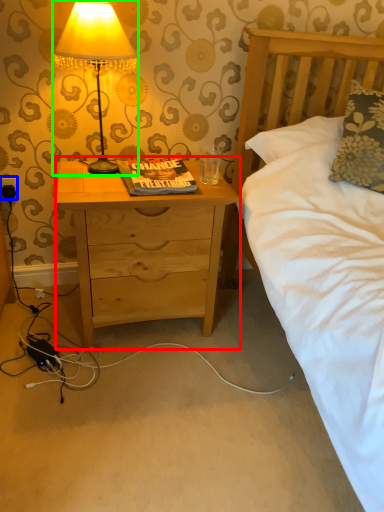
Question: Estimate the real-world distances between objects in this image. Which object is closer to nightstand (highlighted by a red box), electric outlet (highlighted by a blue box) or lamp (highlighted by a green box)?

Choices:
 (A) electric outlet
 (B) lamp

Answer: (B)